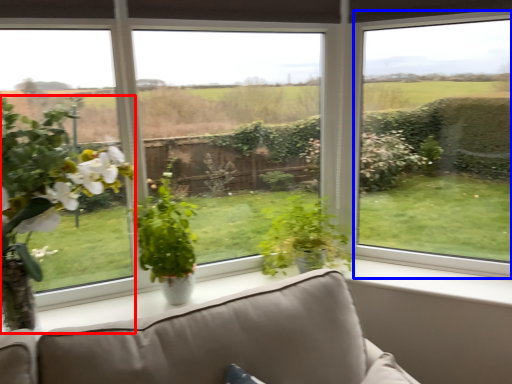
Question: Which object appears closest to the camera in this image, houseplant (highlighted by a red box) or window (highlighted by a blue box)?

Choices:
 (A) houseplant
 (B) window

Answer: (A)